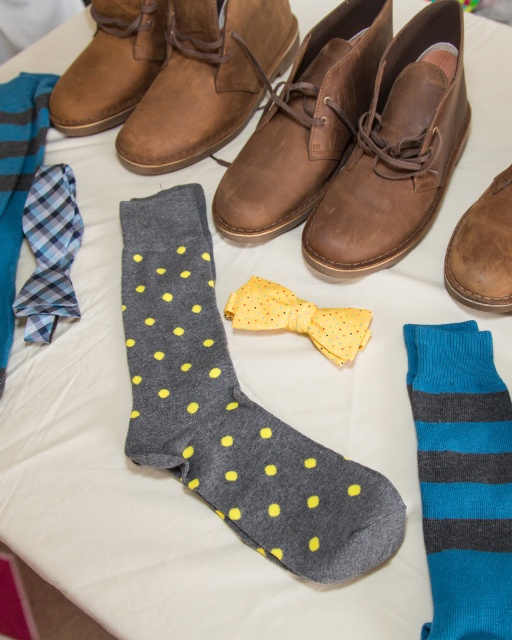
Is point (462, 480) behind point (76, 243)?

That is False.

Between blue/gray striped sock at lower right and blue plaid fabric tie at left, which one appears on the left side from the viewer's perspective?

Positioned to the left is blue plaid fabric tie at left.

Is point (495, 372) less distant than point (65, 173)?

Yes.

The width and height of the screenshot is (512, 640). Find the location of `blue/gray striped sock at lower right`. blue/gray striped sock at lower right is located at coordinates (462, 477).

Which of these two, brown suede boot at upper left or brown suede shoe at right, stands taller?

brown suede boot at upper left is taller.

The width and height of the screenshot is (512, 640). Describe the element at coordinates (111, 67) in the screenshot. I see `brown suede boot at upper left` at that location.

This screenshot has width=512, height=640. Describe the element at coordinates (111, 67) in the screenshot. I see `brown suede boot at upper left` at that location.

Where is `brown suede boot at upper left`? The image size is (512, 640). brown suede boot at upper left is located at coordinates (111, 67).

How much distance is there between leather boot at upper center and brown suede shoe at right?

31.12 centimeters

Can you confirm if leather boot at upper center is smaller than brown suede shoe at right?

No, leather boot at upper center is not smaller than brown suede shoe at right.

The image size is (512, 640). What do you see at coordinates (305, 124) in the screenshot?
I see `leather boot at upper center` at bounding box center [305, 124].

Locate an element on the screen. The height and width of the screenshot is (640, 512). leather boot at upper center is located at coordinates tap(305, 124).